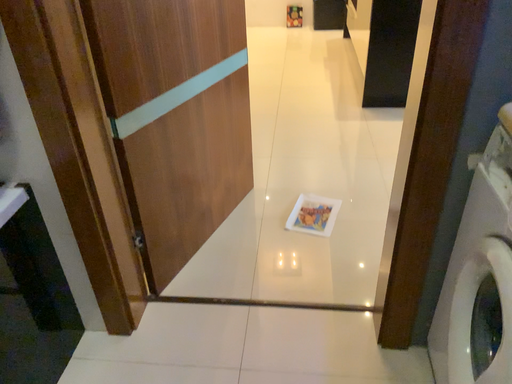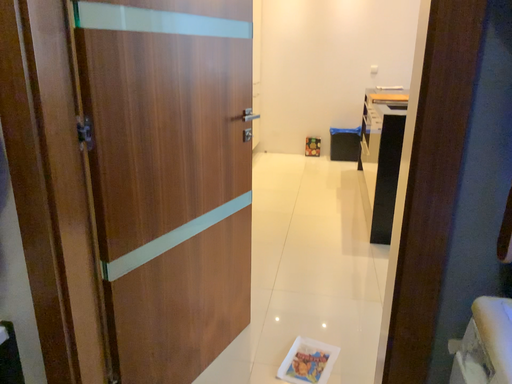
Question: How did the camera likely rotate when shooting the video?

Choices:
 (A) rotated upward
 (B) rotated downward

Answer: (A)